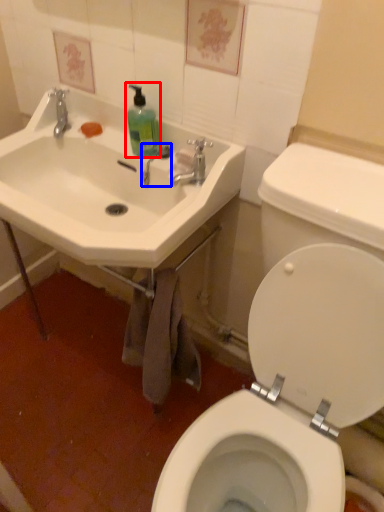
Question: Which object appears closest to the camera in this image, cleaning product (highlighted by a red box) or plumbing fixture (highlighted by a blue box)?

Choices:
 (A) cleaning product
 (B) plumbing fixture

Answer: (A)